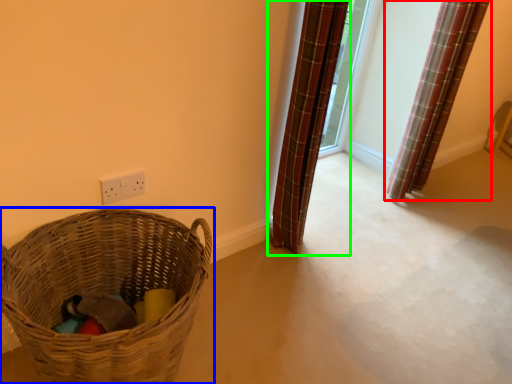
Question: Which is nearer to the curtain (highlighted by a red box)? picnic basket (highlighted by a blue box) or curtain (highlighted by a green box).

Choices:
 (A) picnic basket
 (B) curtain

Answer: (B)